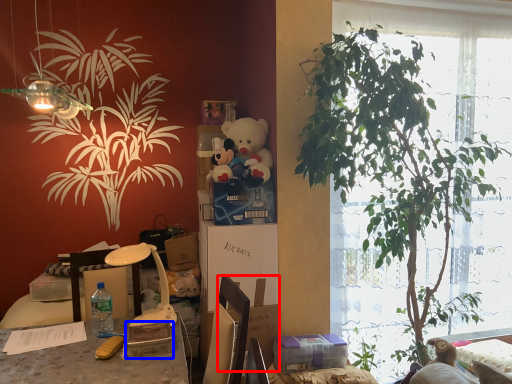
Question: Among these objects, which one is farthest to the camera, cardboard box (highlighted by a red box) or box (highlighted by a blue box)?

Choices:
 (A) cardboard box
 (B) box

Answer: (A)